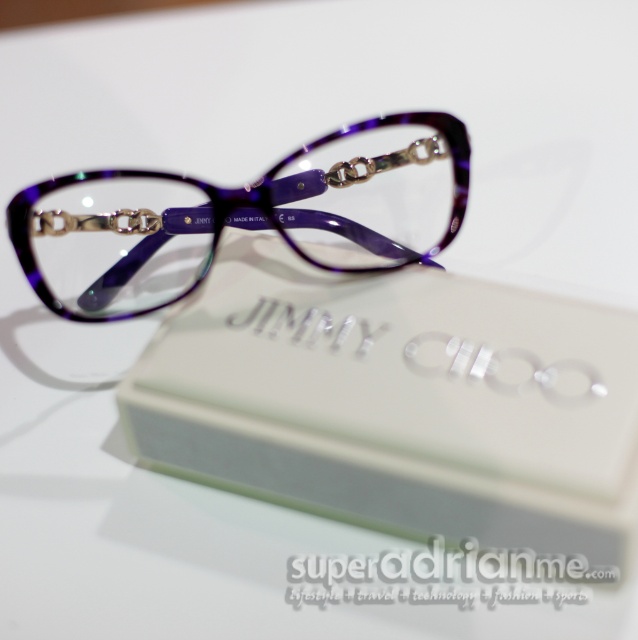
Question: Which point appears closest to the camera in this image?

Choices:
 (A) (202, 452)
 (B) (454, 196)

Answer: (A)

Question: Is matte purple plastic box at center further to camera compared to purple marbled glasses at center?

Choices:
 (A) no
 (B) yes

Answer: (A)

Question: Which point is farther to the camera?

Choices:
 (A) matte purple plastic box at center
 (B) purple marbled glasses at center

Answer: (B)

Question: In this image, where is matte purple plastic box at center located relative to purple marbled glasses at center?

Choices:
 (A) left
 (B) right

Answer: (B)

Question: Does matte purple plastic box at center appear on the right side of purple marbled glasses at center?

Choices:
 (A) no
 (B) yes

Answer: (B)